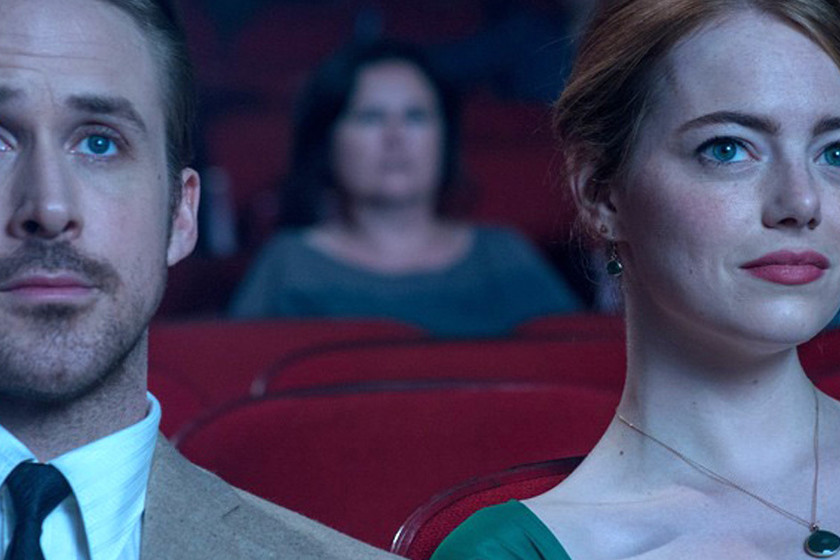
The width and height of the screenshot is (840, 560). Find the location of `seat`. seat is located at coordinates (412, 432).